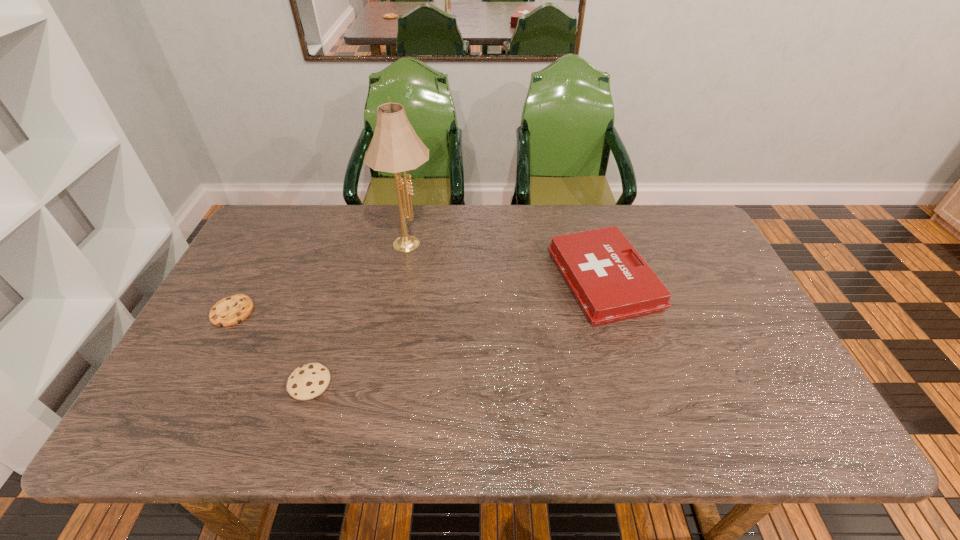
At what (x,y) coordinates should I click in order to perform the action: click on unoccupied area between the shortest object and the first-aid kit. Please return your answer as a coordinate pair (x, y). Looking at the image, I should click on (419, 295).

Locate an element on the screen. This screenshot has height=540, width=960. the third closest object to the nearest object is located at coordinates (610, 284).

Identify which object is the third nearest to the shorter cookie. Please provide its 2D coordinates. Your answer should be formatted as a tuple, i.e. [(x, y)], where the tuple contains the x and y coordinates of a point satisfying the conditions above.

[(610, 284)]

The height and width of the screenshot is (540, 960). Identify the location of vacant area in the image that satisfies the following two spatial constraints: 1. on the back side of the shorter cookie; 2. on the left side of the second tallest object. (250, 280).

Find the location of a particular element. This screenshot has width=960, height=540. free space that satisfies the following two spatial constraints: 1. on the back side of the tallest object; 2. on the right side of the shorter cookie is located at coordinates (271, 240).

The image size is (960, 540). What are the coordinates of `vacant space that satisfies the following two spatial constraints: 1. on the back side of the left cookie; 2. on the right side of the second tallest object` in the screenshot? It's located at (250, 280).

The height and width of the screenshot is (540, 960). In order to click on free spot that satisfies the following two spatial constraints: 1. on the back side of the second tallest object; 2. on the right side of the farther cookie in this screenshot , I will do `click(250, 280)`.